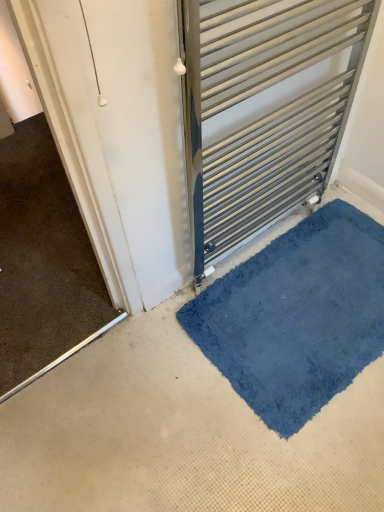
Image resolution: width=384 pixels, height=512 pixels. In order to click on vacant area situated below satin silver towel rack at center (from a real-world perspective) in this screenshot , I will do `click(251, 247)`.